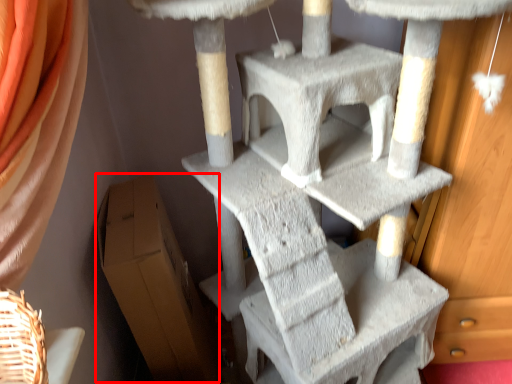
Question: From the image's perspective, what is the correct spatial positioning of cardboard box (annotated by the red box) in reference to furniture?

Choices:
 (A) below
 (B) above

Answer: (A)